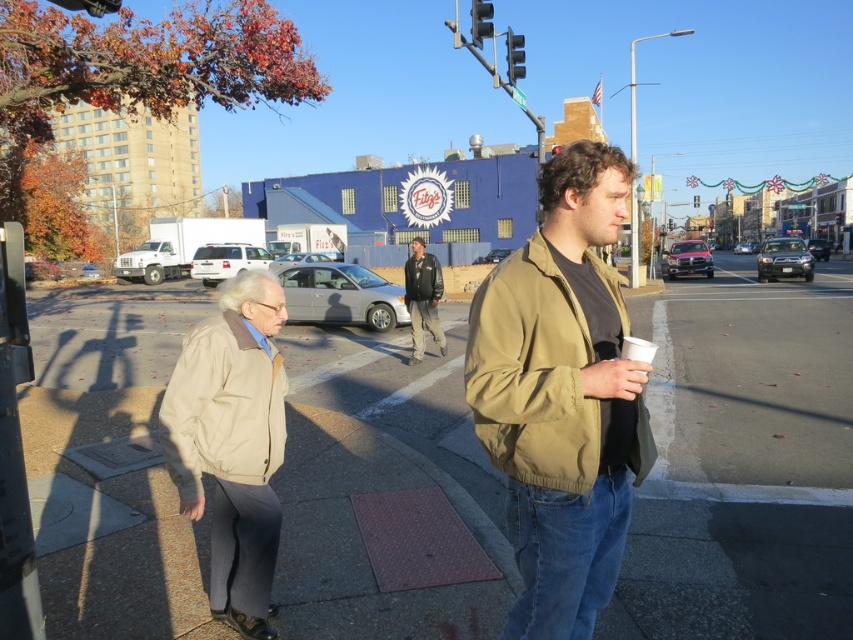
Based on the scene description, where is the smooth concrete sidewalk at center located in terms of coordinates?

The smooth concrete sidewalk at center is located at point coordinates of [743,465].

You are a delivery person who needs to place a package on the smooth concrete sidewalk at center. However, there is a metallic traffic light at upper center nearby. Can you place the package on the sidewalk without it being under the traffic light?

The smooth concrete sidewalk at center is shorter than the metallic traffic light at upper center, so placing the package on the sidewalk might still be possible as long as it is positioned away from the area directly under the traffic light.

You are standing at point (x=474, y=3) and want to walk to the building with the Fitg logo. There is a person at point (x=393, y=410) blocking your path. Can you walk around them to reach the building?

Point (x=393, y=410) is in front of point (x=474, y=3). Since the person at point (x=393, y=410) is blocking your path, you would need to go around them either to the left or right to reach the building with the Fitg logo.